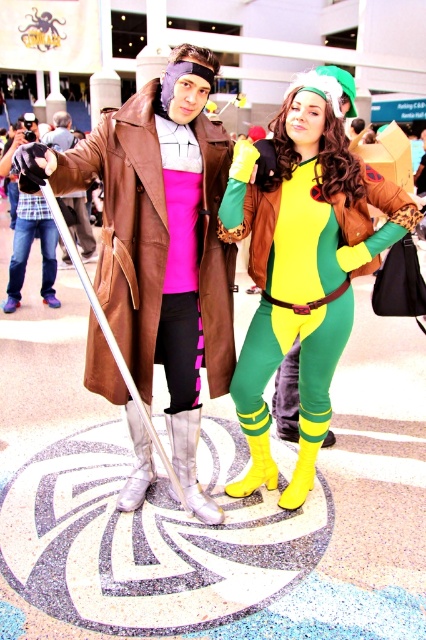
Question: Among these points, which one is farthest from the camera?

Choices:
 (A) (340, 225)
 (B) (86, 376)

Answer: (B)

Question: Is green spandex suit at center above matte brown coat at center?

Choices:
 (A) no
 (B) yes

Answer: (A)

Question: Among these points, which one is nearest to the camera?

Choices:
 (A) (120, 380)
 (B) (261, 468)

Answer: (A)

Question: Is green spandex suit at center wider than matte brown coat at center?

Choices:
 (A) yes
 (B) no

Answer: (A)

Question: Can you confirm if green spandex suit at center is wider than matte brown coat at center?

Choices:
 (A) no
 (B) yes

Answer: (B)